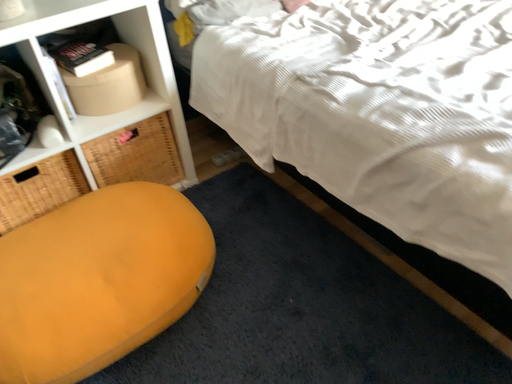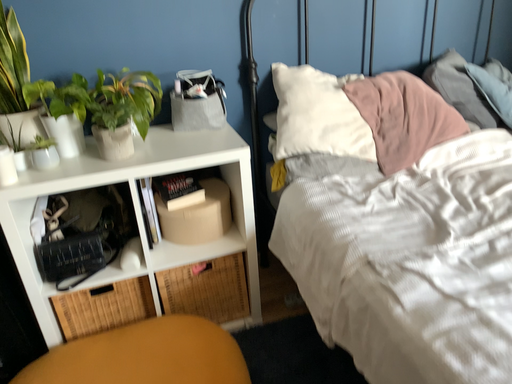
Question: Which way did the camera rotate in the video?

Choices:
 (A) rotated right
 (B) rotated left

Answer: (B)